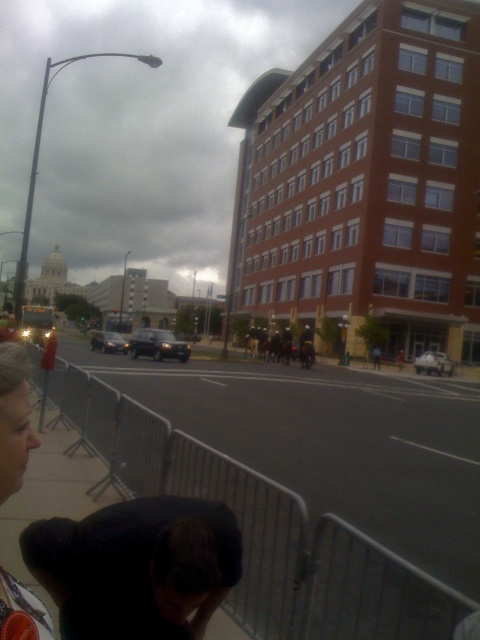
Consider the image. Who is more distant from viewer, (159,465) or (137,346)?

Point (137,346)

Is point (375, 596) closer to viewer compared to point (171, 349)?

Yes, it is in front of point (171, 349).

Between point (63, 416) and point (167, 353), which one is positioned behind?

The point (167, 353) is more distant.

At what (x,y) coordinates should I click in order to perform the action: click on gray metallic pavement at lower center. Please return your answer as a coordinate pair (x, y). The width and height of the screenshot is (480, 640). Looking at the image, I should click on (261, 529).

Which is in front, point (108, 512) or point (184, 356)?

Point (108, 512)

Can you confirm if dark brown hair at lower center is taller than dark gray matte suv at center?

In fact, dark brown hair at lower center may be shorter than dark gray matte suv at center.

Where is `dark brown hair at lower center`? dark brown hair at lower center is located at coordinates (137, 564).

This screenshot has width=480, height=640. I want to click on dark brown hair at lower center, so click(137, 564).

Based on the photo, does dark brown hair at lower center appear on the left side of matte black hair at lower left?

No, dark brown hair at lower center is not to the left of matte black hair at lower left.

Which is more to the right, dark brown hair at lower center or matte black hair at lower left?

Positioned to the right is dark brown hair at lower center.

Identify the location of dark brown hair at lower center. (137, 564).